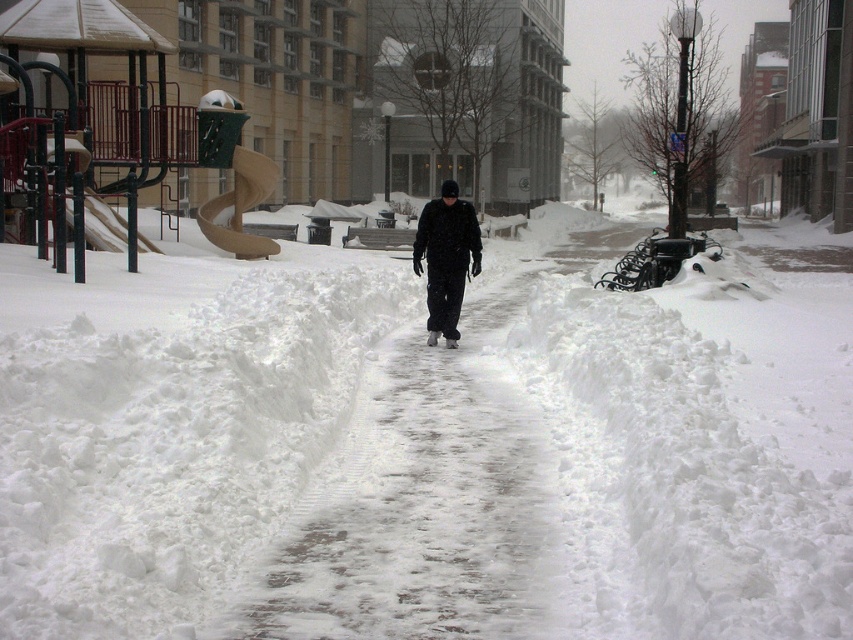
Does white fluffy snow at center appear on the right side of black matte jacket at center?

Indeed, white fluffy snow at center is positioned on the right side of black matte jacket at center.

Consider the image. Can you confirm if white fluffy snow at center is positioned above black matte jacket at center?

Incorrect, white fluffy snow at center is not positioned above black matte jacket at center.

Who is more distant from viewer, (776, 339) or (456, 236)?

Positioned behind is point (456, 236).

Find the location of `white fluffy snow at center`. white fluffy snow at center is located at coordinates (425, 449).

Does white icy sidewalk at center have a larger size compared to black matte jacket at center?

Yes, white icy sidewalk at center is bigger than black matte jacket at center.

Who is positioned more to the left, white icy sidewalk at center or black matte jacket at center?

black matte jacket at center is more to the left.

Is point (277, 547) less distant than point (457, 273)?

Yes, point (277, 547) is in front of point (457, 273).

Identify the location of white icy sidewalk at center. (418, 500).

Is point (405, 548) farther from viewer compared to point (346, 497)?

No, it is in front of (346, 497).

Does white fluffy snow at center have a greater width compared to white icy sidewalk at center?

Indeed, white fluffy snow at center has a greater width compared to white icy sidewalk at center.

The width and height of the screenshot is (853, 640). What are the coordinates of `white fluffy snow at center` in the screenshot? It's located at (425, 449).